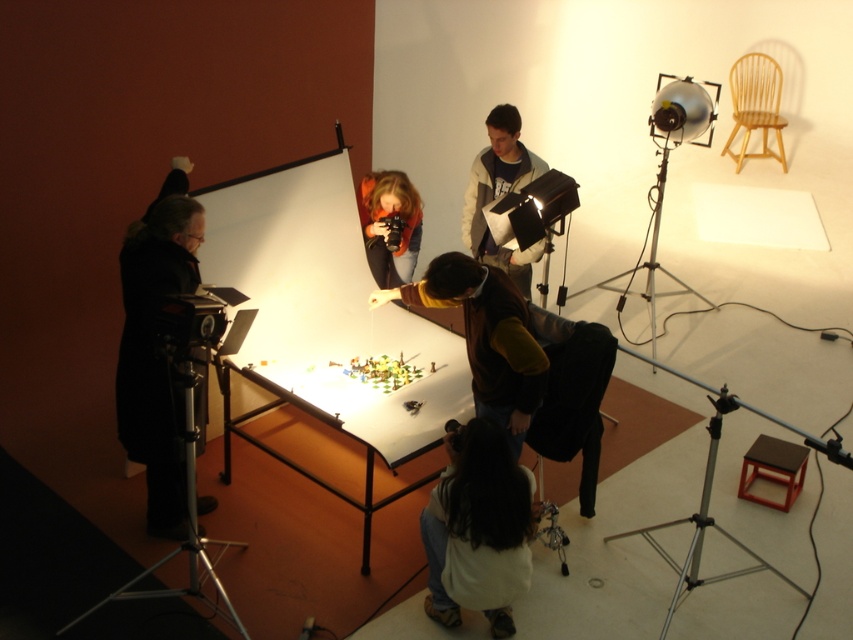
You are a photographer trying to adjust the height of your camera to get a better angle on the objects on the white glossy table at center. The silver metallic tripod at lower left is your only support. Can you raise the tripod high enough to match the table height?

The white glossy table at center is much taller than the silver metallic tripod at lower left, so the tripod cannot be raised high enough to match the table height. You will need a taller tripod or a way to elevate the current one.

From the picture: You are a photographer trying to adjust the lighting setup in the studio. You need to move the matte gray hoodie at center out of the way temporarily. Since you are standing behind the silver metallic tripod at lower left, which object should you move first to reach the hoodie?

The matte gray hoodie at center is closer to you than the silver metallic tripod at lower left, so you should move the matte gray hoodie at center first to access the area behind it.